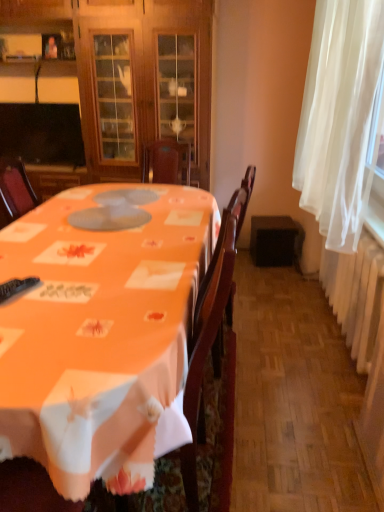
You are a GUI agent. You are given a task and a screenshot of the screen. Output one action in this format:
    pyautogui.click(x=<x>, y=<y>)
    Task: Click on the free space in front of black plastic remote control at lower left
    
    Given the screenshot: What is the action you would take?
    pyautogui.click(x=21, y=318)